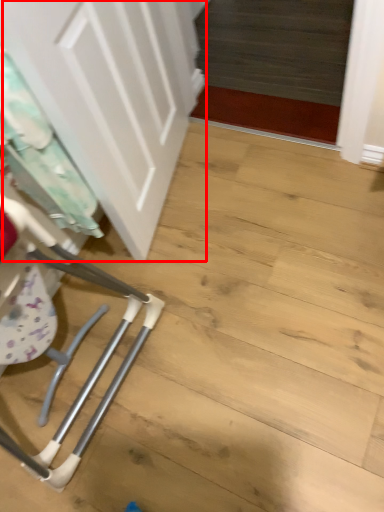
Question: From the image's perspective, what is the correct spatial positioning of door (annotated by the red box) in reference to laundry?

Choices:
 (A) below
 (B) above

Answer: (B)